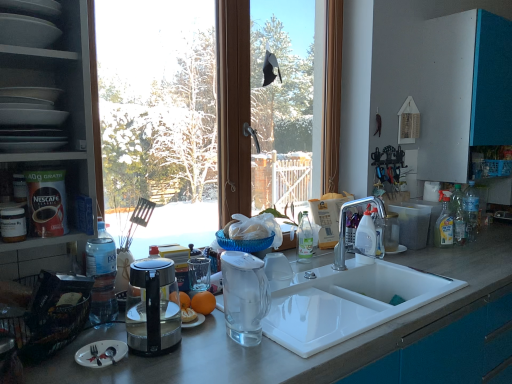
Question: Is silver matte fork at lower left smaller than transparent glass window at center?

Choices:
 (A) no
 (B) yes

Answer: (B)

Question: Does silver matte fork at lower left lie in front of transparent glass window at center?

Choices:
 (A) no
 (B) yes

Answer: (B)

Question: Does silver matte fork at lower left appear on the right side of transparent glass window at center?

Choices:
 (A) yes
 (B) no

Answer: (B)

Question: From the image's perspective, is silver matte fork at lower left located beneath transparent glass window at center?

Choices:
 (A) no
 (B) yes

Answer: (B)

Question: From the image's perspective, would you say silver matte fork at lower left is positioned over transparent glass window at center?

Choices:
 (A) no
 (B) yes

Answer: (A)

Question: Is silver matte fork at lower left turned away from transparent glass window at center?

Choices:
 (A) yes
 (B) no

Answer: (B)

Question: Can you confirm if matte gray plates at upper left, arranged as the 2th shelf when ordered from the bottom, is bigger than clear plastic bottle at right, which is counted as the 2th bottle, starting from the front?

Choices:
 (A) yes
 (B) no

Answer: (B)

Question: Are matte gray plates at upper left, arranged as the 2th shelf when ordered from the bottom, and clear plastic bottle at right, which is counted as the 2th bottle, starting from the left, beside each other?

Choices:
 (A) yes
 (B) no

Answer: (B)

Question: From a real-world perspective, is matte gray plates at upper left, arranged as the 2th shelf when ordered from the bottom, located beneath clear plastic bottle at right, the 1th bottle from the right?

Choices:
 (A) yes
 (B) no

Answer: (B)

Question: From a real-world perspective, is matte gray plates at upper left, arranged as the 2th shelf when ordered from the bottom, on clear plastic bottle at right, which is counted as the 2th bottle, starting from the left?

Choices:
 (A) yes
 (B) no

Answer: (A)

Question: Is clear plastic bottle at right, which is counted as the 2th bottle, starting from the front, inside matte gray plates at upper left, which is the 1th shelf from top to bottom?

Choices:
 (A) no
 (B) yes

Answer: (A)

Question: Is matte gray plates at upper left, arranged as the 2th shelf when ordered from the bottom, taller than clear plastic bottle at right, the 1th bottle viewed from the back?

Choices:
 (A) yes
 (B) no

Answer: (B)

Question: From the image's perspective, is silver matte fork at lower left under matte white plates at left, the second shelf in the top-to-bottom sequence?

Choices:
 (A) yes
 (B) no

Answer: (A)